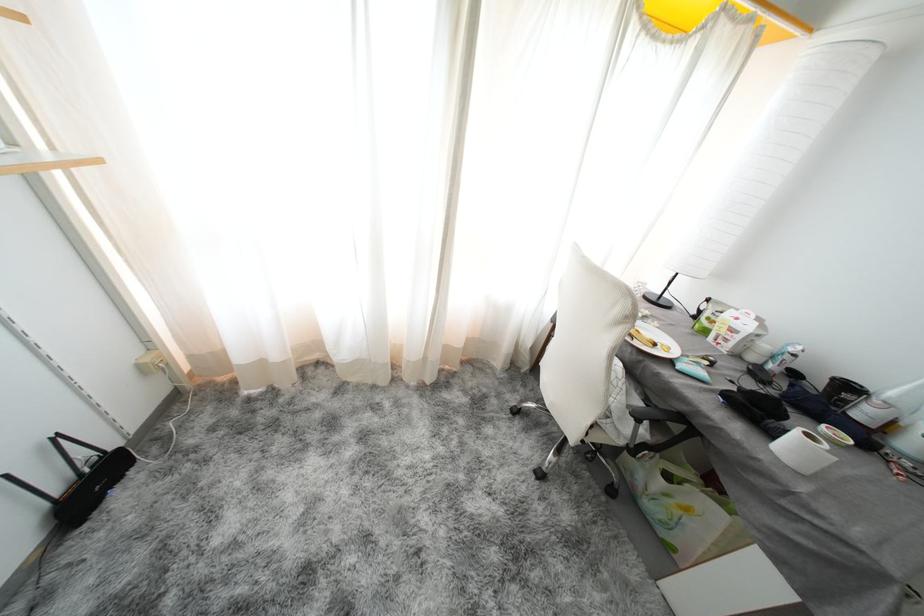
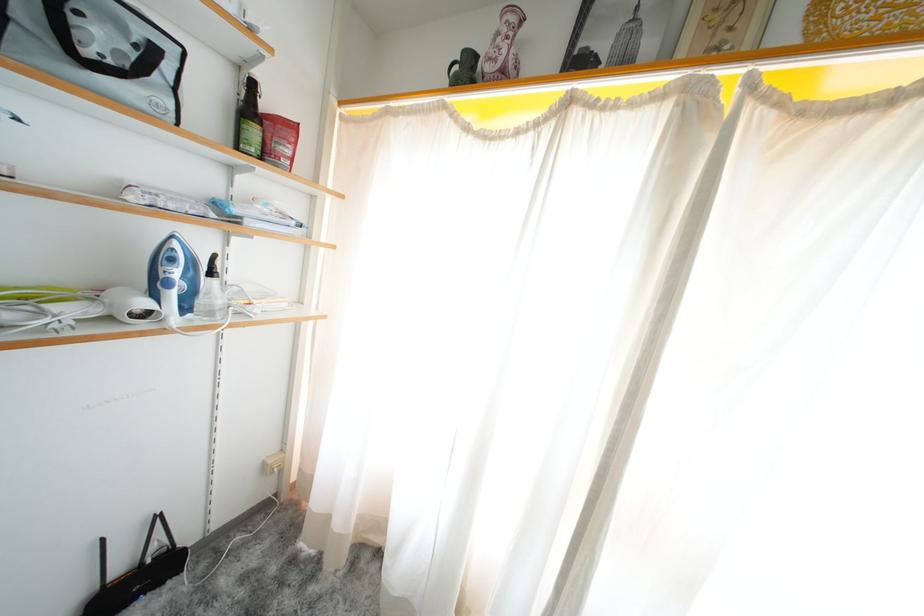
Where in the second image is the point corresponding to pixel 198 361 from the first image?

(306, 475)